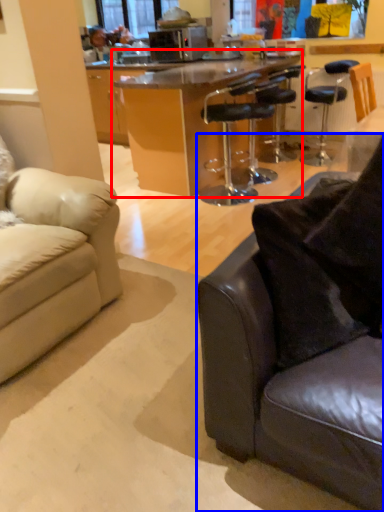
Question: Among these objects, which one is nearest to the camera, table (highlighted by a red box) or studio couch (highlighted by a blue box)?

Choices:
 (A) table
 (B) studio couch

Answer: (B)